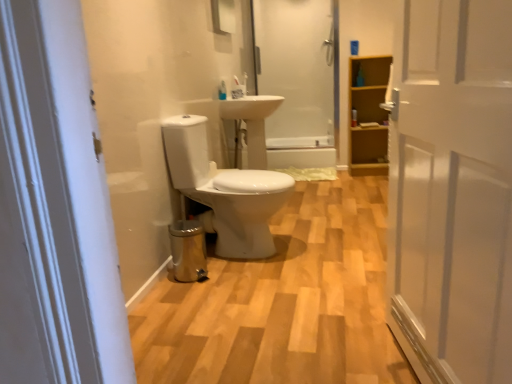
The height and width of the screenshot is (384, 512). I want to click on white glossy toilet at center, so click(283, 302).

The height and width of the screenshot is (384, 512). What do you see at coordinates (223, 16) in the screenshot?
I see `glossy glass mirror at upper center` at bounding box center [223, 16].

What is the approximate width of white glossy sink at center?

The width of white glossy sink at center is 17.78 inches.

Where is `translucent plastic bottle at upper right, acting as the 2th toiletry starting from the front`? The width and height of the screenshot is (512, 384). translucent plastic bottle at upper right, acting as the 2th toiletry starting from the front is located at coordinates (353, 117).

The image size is (512, 384). Describe the element at coordinates (353, 117) in the screenshot. I see `translucent plastic bottle at upper right, acting as the 2th toiletry starting from the front` at that location.

This screenshot has height=384, width=512. Find the location of `white glossy toilet at center`. white glossy toilet at center is located at coordinates (283, 302).

In terms of height, does white glossy toilet at center look taller or shorter compared to translucent glass shower door at upper center?

In the image, white glossy toilet at center appears to be shorter than translucent glass shower door at upper center.

Which is closer, (353, 351) or (293, 13)?

The point (353, 351) is in front.

Is white glossy toilet at center at the right side of translucent glass shower door at upper center?

No, white glossy toilet at center is not to the right of translucent glass shower door at upper center.

From a real-world perspective, relative to white wooden door at right, is glossy glass mirror at upper center vertically above or below?

glossy glass mirror at upper center is situated higher than white wooden door at right in the real world.

In the image, is glossy glass mirror at upper center positioned in front of or behind white wooden door at right?

Visually, glossy glass mirror at upper center is located behind white wooden door at right.

Is glossy glass mirror at upper center outside of white wooden door at right?

Yes.

Who is bigger, translucent glass shower door at upper center or translucent plastic bottle at upper right, which ranks as the 1th toiletry in back-to-front order?

Bigger between the two is translucent glass shower door at upper center.

Looking at this image, from the image's perspective, is translucent glass shower door at upper center on top of translucent plastic bottle at upper right, which is the 1th toiletry in right-to-left order?

Yes, from the image's perspective, translucent glass shower door at upper center is above translucent plastic bottle at upper right, which is the 1th toiletry in right-to-left order.

Is translucent glass shower door at upper center turned away from translucent plastic bottle at upper right, which is the 1th toiletry in right-to-left order?

No.

Is translucent glass shower door at upper center positioned beyond the bounds of translucent plastic bottle at upper right, which ranks as the 1th toiletry in back-to-front order?

Yes, translucent glass shower door at upper center is outside of translucent plastic bottle at upper right, which ranks as the 1th toiletry in back-to-front order.

Considering the positions of objects glossy glass mirror at upper center and translucent plastic bottle at upper right, which is the 1th toiletry in right-to-left order, in the image provided, who is more to the left, glossy glass mirror at upper center or translucent plastic bottle at upper right, which is the 1th toiletry in right-to-left order,?

glossy glass mirror at upper center.

Does glossy glass mirror at upper center have a larger size compared to translucent plastic bottle at upper right, which ranks as the 1th toiletry in back-to-front order?

Correct, glossy glass mirror at upper center is larger in size than translucent plastic bottle at upper right, which ranks as the 1th toiletry in back-to-front order.

Is glossy glass mirror at upper center with translucent plastic bottle at upper right, marked as the second toiletry in a left-to-right arrangement?

glossy glass mirror at upper center is not next to translucent plastic bottle at upper right, marked as the second toiletry in a left-to-right arrangement, and they're not touching.

You are a GUI agent. You are given a task and a screenshot of the screen. Output one action in this format:
    pyautogui.click(x=<x>, y=<y>)
    Task: Click on the sink located underneath the glossy glass mirror at upper center (from a real-world perspective)
    This screenshot has width=512, height=384.
    Given the screenshot: What is the action you would take?
    pyautogui.click(x=252, y=123)

Considering the positions of points (215, 24) and (252, 134), is point (215, 24) farther from camera compared to point (252, 134)?

No, it is not.

Between glossy glass mirror at upper center and white glossy sink at center, which one appears on the right side from the viewer's perspective?

white glossy sink at center.

Is glossy glass mirror at upper center wider or thinner than white glossy sink at center?

Considering their sizes, glossy glass mirror at upper center looks slimmer than white glossy sink at center.

Can you tell me how much white glossy sink at center and translucent plastic bottle at upper right, acting as the 2th toiletry starting from the front, differ in facing direction?

The facing directions of white glossy sink at center and translucent plastic bottle at upper right, acting as the 2th toiletry starting from the front, are 90.3 degrees apart.

From the image's perspective, is white glossy sink at center located above or below translucent plastic bottle at upper right, which is the 1th toiletry in right-to-left order?

white glossy sink at center is below translucent plastic bottle at upper right, which is the 1th toiletry in right-to-left order.

Is white glossy sink at center turned away from translucent plastic bottle at upper right, acting as the 2th toiletry starting from the front?

That's not correct — white glossy sink at center is not looking away from translucent plastic bottle at upper right, acting as the 2th toiletry starting from the front.

Is white glossy sink at center directly adjacent to translucent plastic bottle at upper right, marked as the second toiletry in a left-to-right arrangement?

No, white glossy sink at center is not in contact with translucent plastic bottle at upper right, marked as the second toiletry in a left-to-right arrangement.

Are translucent plastic toothbrush at center, the 2th toiletry positioned from the right, and light brown wood cabinet at right far apart?

That's right, there is a large distance between translucent plastic toothbrush at center, the 2th toiletry positioned from the right, and light brown wood cabinet at right.

From a real-world perspective, between translucent plastic toothbrush at center, the first toiletry positioned from the left, and light brown wood cabinet at right, who is vertically lower?

light brown wood cabinet at right.

Is translucent plastic toothbrush at center, the first toiletry positioned from the left, to the right of light brown wood cabinet at right from the viewer's perspective?

No, translucent plastic toothbrush at center, the first toiletry positioned from the left, is not to the right of light brown wood cabinet at right.

Considering their positions, is translucent plastic toothbrush at center, which is the second toiletry from back to front, located in front of or behind light brown wood cabinet at right?

translucent plastic toothbrush at center, which is the second toiletry from back to front, is in front of light brown wood cabinet at right.

Where is `plain that is under the translucent glass shower door at upper center (from a real-world perspective)`? The height and width of the screenshot is (384, 512). plain that is under the translucent glass shower door at upper center (from a real-world perspective) is located at coordinates (283, 302).

The height and width of the screenshot is (384, 512). What are the coordinates of `mirror lying on the left of white wooden door at right` in the screenshot? It's located at (223, 16).

Consider the image. From the image, which object appears to be nearer to light brown wood cabinet at right, translucent glass shower door at upper center or white glossy sink at center?

Based on the image, translucent glass shower door at upper center appears to be nearer to light brown wood cabinet at right.

Looking at the image, which one is located closer to light brown wood cabinet at right, translucent plastic bottle at upper right, marked as the second toiletry in a left-to-right arrangement, or white wooden door at right?

translucent plastic bottle at upper right, marked as the second toiletry in a left-to-right arrangement, lies closer to light brown wood cabinet at right than the other object.

From the image, which object appears to be farther from translucent plastic toothbrush at center, which is the 1th toiletry in front-to-back order, white glossy sink at center or white wooden door at right?

Based on the image, white wooden door at right appears to be further to translucent plastic toothbrush at center, which is the 1th toiletry in front-to-back order.

Which object lies further to the anchor point white glossy toilet at center, translucent plastic bottle at upper right, marked as the second toiletry in a left-to-right arrangement, or glossy glass mirror at upper center?

translucent plastic bottle at upper right, marked as the second toiletry in a left-to-right arrangement.

Estimate the real-world distances between objects in this image. Which object is closer to white glossy toilet at center, translucent glass shower door at upper center or white wooden door at right?

Among the two, white wooden door at right is located nearer to white glossy toilet at center.

Estimate the real-world distances between objects in this image. Which object is further from light brown wood cabinet at right, translucent glass shower door at upper center or white wooden door at right?

white wooden door at right.

Estimate the real-world distances between objects in this image. Which object is further from white wooden door at right, white glossy toilet at center or light brown wood cabinet at right?

Among the two, light brown wood cabinet at right is located further to white wooden door at right.

Based on their spatial positions, is translucent glass shower door at upper center or white glossy sink at center closer to translucent plastic bottle at upper right, marked as the second toiletry in a left-to-right arrangement?

Among the two, translucent glass shower door at upper center is located nearer to translucent plastic bottle at upper right, marked as the second toiletry in a left-to-right arrangement.

Identify the location of toiletry positioned between white glossy toilet at center and translucent plastic bottle at upper right, which is the 1th toiletry in right-to-left order, from near to far. (222, 91).

Identify the location of sink located between white wooden door at right and translucent plastic bottle at upper right, which is the 1th toiletry in right-to-left order, in the depth direction. This screenshot has width=512, height=384. (252, 123).

The image size is (512, 384). I want to click on mirror between white wooden door at right and white glossy sink at center in the front-back direction, so click(x=223, y=16).

Where is `toiletry located between glossy glass mirror at upper center and translucent plastic bottle at upper right, marked as the second toiletry in a left-to-right arrangement, in the left-right direction`? The width and height of the screenshot is (512, 384). toiletry located between glossy glass mirror at upper center and translucent plastic bottle at upper right, marked as the second toiletry in a left-to-right arrangement, in the left-right direction is located at coordinates (222, 91).